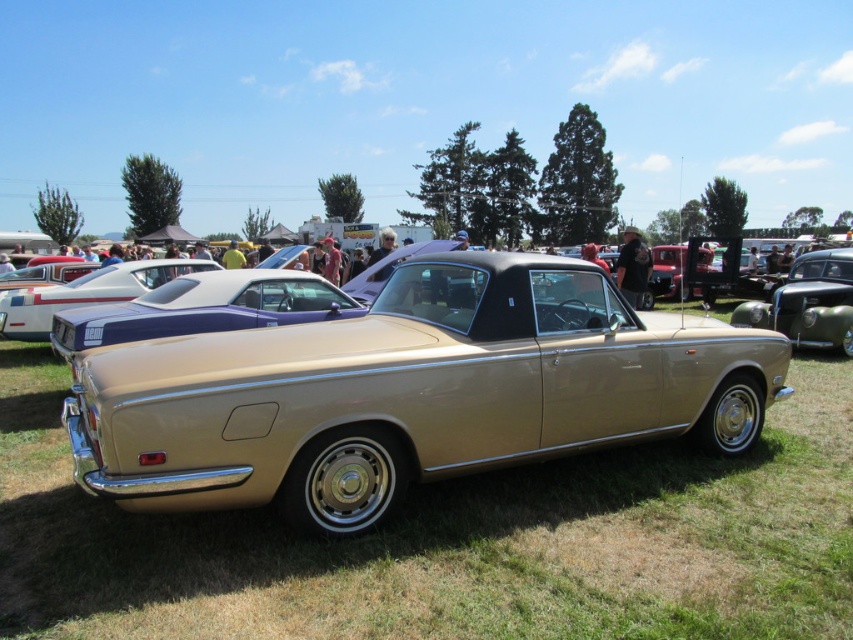
You are a photographer setting up a tripod to capture both the metallic gold car at center and the shiny blue car at center. Since you want to include both cars in the frame without moving the tripod, which car should you position closer to the center of the camera lens to ensure they both fit?

The metallic gold car at center is thinner than the shiny blue car at center, so you should position the metallic gold car at center closer to the center of the camera lens. This will allow the wider shiny blue car at center to still fit within the frame while keeping the thinner metallic gold car at center properly centered.

You are a photographer standing at the edge of the car exhibition. You want to take a photo that includes both the gold metallic convertible at center and the metallic gold car at center. Given that your camera can focus on objects up to 10 meters apart, will both cars be in focus?

The gold metallic convertible at center is 8.27 meters away from the metallic gold car at center. Since the maximum distance your camera can focus is 10 meters, both cars will be within the focus range and should appear sharp in the photo.

You are at a classic car exhibition and see two cars in the center area. The first is a gold metallic convertible at center and the second is a metallic gold car at center. According to the scene description, which car is positioned to the left?

The gold metallic convertible at center is positioned to the left of the metallic gold car at center.